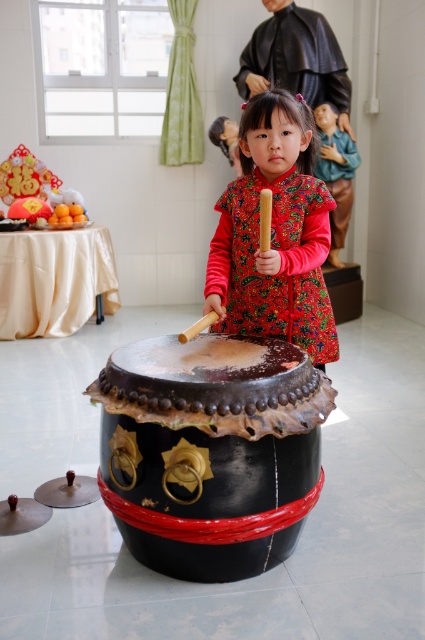
Question: Does black leather drum at center have a greater width compared to floral brocade dress at center?

Choices:
 (A) yes
 (B) no

Answer: (A)

Question: In this image, where is black leather drum at center located relative to floral brocade dress at center?

Choices:
 (A) below
 (B) above

Answer: (A)

Question: Does black leather drum at center appear on the left side of floral brocade dress at center?

Choices:
 (A) no
 (B) yes

Answer: (B)

Question: Which point appears farthest from the camera in this image?

Choices:
 (A) (201, 445)
 (B) (323, 186)

Answer: (B)